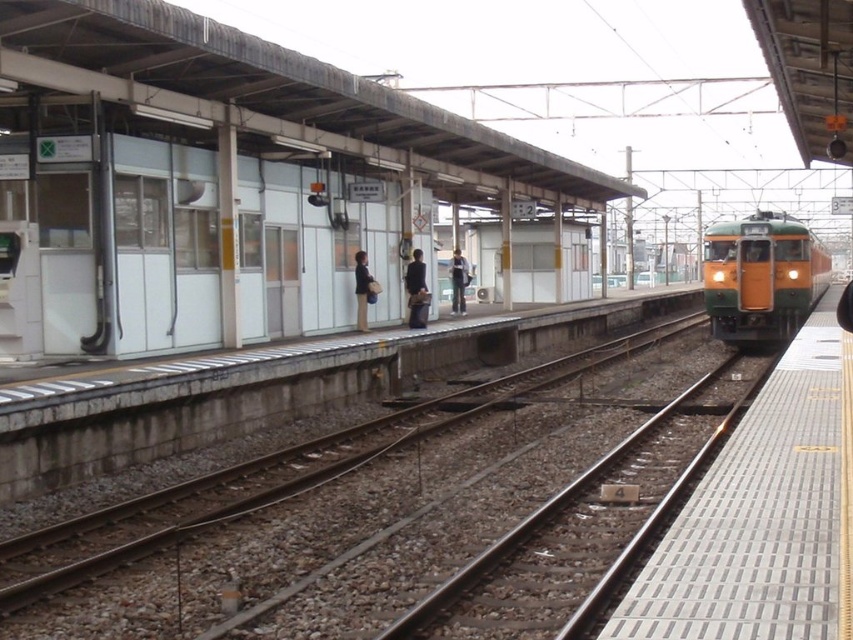
Question: Which point is farther to the camera?

Choices:
 (A) (672, 413)
 (B) (422, 282)

Answer: (B)

Question: Considering the relative positions of yellow-green metal train at right and dark blue fabric jacket at center in the image provided, where is yellow-green metal train at right located with respect to dark blue fabric jacket at center?

Choices:
 (A) above
 (B) below

Answer: (A)

Question: Estimate the real-world distances between objects in this image. Which object is farther from the brown gravel train track at center?

Choices:
 (A) dark blue fabric jacket at center
 (B) gravel train track at center
 (C) yellow-green metal train at right

Answer: (C)

Question: Does dark brown leather jacket at center come behind dark gray fabric jacket at center?

Choices:
 (A) yes
 (B) no

Answer: (B)

Question: Which object is closer to the camera taking this photo?

Choices:
 (A) dark brown leather jacket at center
 (B) brown gravel train track at center
 (C) yellow-green metal train at right
 (D) dark gray fabric jacket at center

Answer: (B)

Question: Does yellow-green metal train at right have a greater width compared to dark blue fabric jacket at center?

Choices:
 (A) yes
 (B) no

Answer: (A)